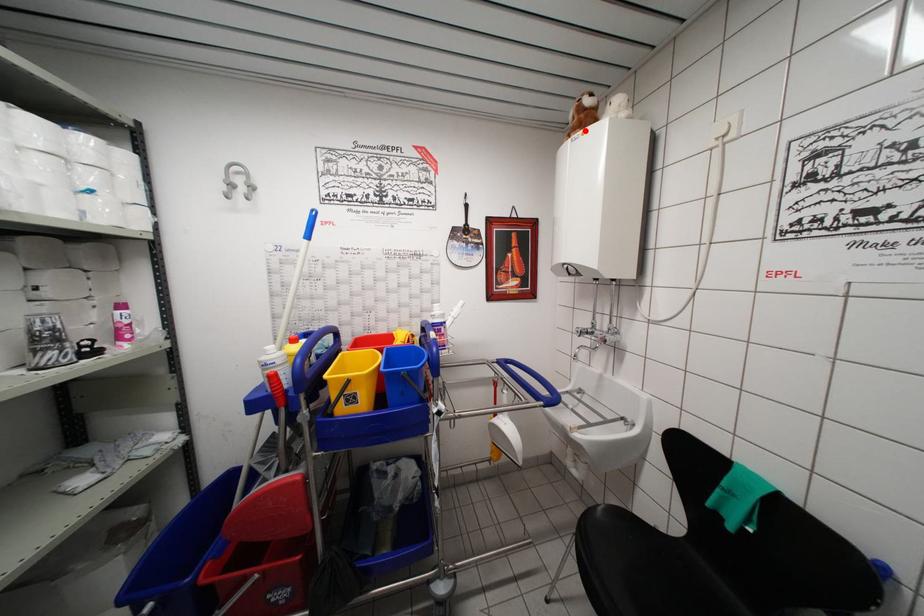
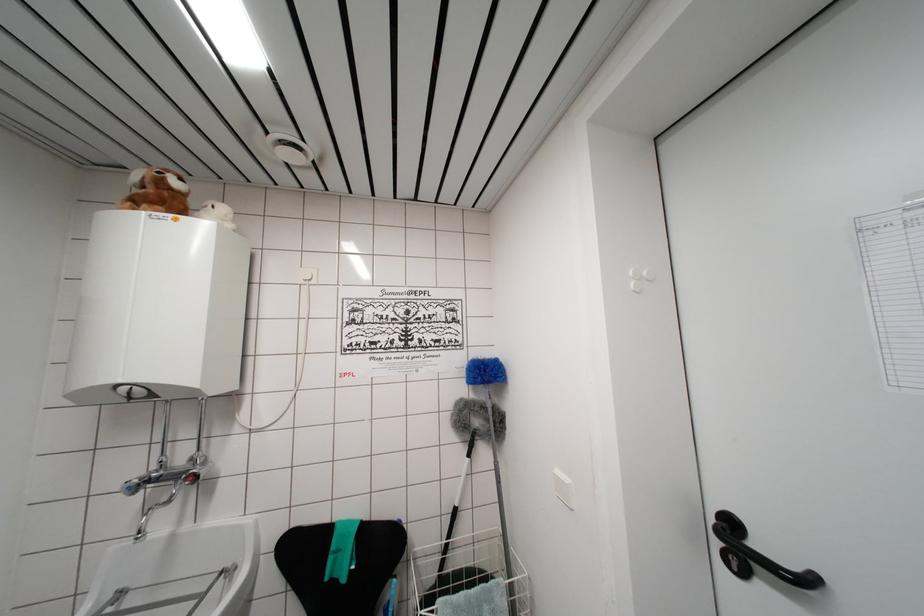
Locate, in the second image, the point that corresponds to the highlighted location in the first image.

(168, 209)